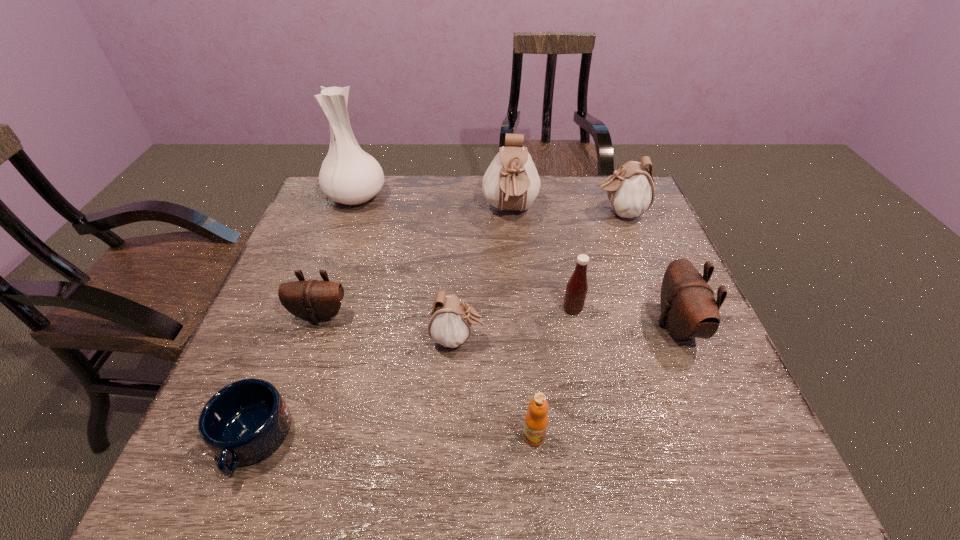
This screenshot has width=960, height=540. In order to click on the leftmost pouch in this screenshot , I will do `click(313, 300)`.

Where is `the left brown pouch`? This screenshot has width=960, height=540. the left brown pouch is located at coordinates (313, 300).

Image resolution: width=960 pixels, height=540 pixels. In order to click on blue mug in this screenshot , I will do `click(243, 423)`.

At what (x,y) coordinates should I click in order to perform the action: click on the shortest object. Please return your answer as a coordinate pair (x, y). Looking at the image, I should click on (243, 423).

The width and height of the screenshot is (960, 540). Find the location of `free region located 0.400m on the front of the vase`. free region located 0.400m on the front of the vase is located at coordinates (313, 314).

In order to click on free region located on the front-facing side of the biggest white pouch in this screenshot , I will do `click(516, 281)`.

At what (x,y) coordinates should I click in order to perform the action: click on vacant space located on the front-facing side of the rightmost white pouch. Please return your answer as a coordinate pair (x, y). This screenshot has width=960, height=540. Looking at the image, I should click on (480, 212).

Where is `blank space located 0.280m on the front-facing side of the rightmost white pouch`? Image resolution: width=960 pixels, height=540 pixels. blank space located 0.280m on the front-facing side of the rightmost white pouch is located at coordinates tap(500, 212).

Locate an element on the screen. This screenshot has height=540, width=960. vacant position located 0.270m on the front-facing side of the rightmost white pouch is located at coordinates (503, 212).

This screenshot has width=960, height=540. What are the coordinates of `vacant space located 0.200m on the left of the white Tabasco sauce` in the screenshot? It's located at (479, 309).